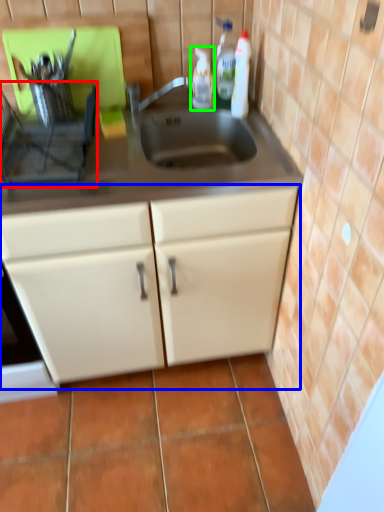
Question: Which is farther away from appliance (highlighted by a red box)? cabinetry (highlighted by a blue box) or bottle (highlighted by a green box)?

Choices:
 (A) cabinetry
 (B) bottle

Answer: (B)